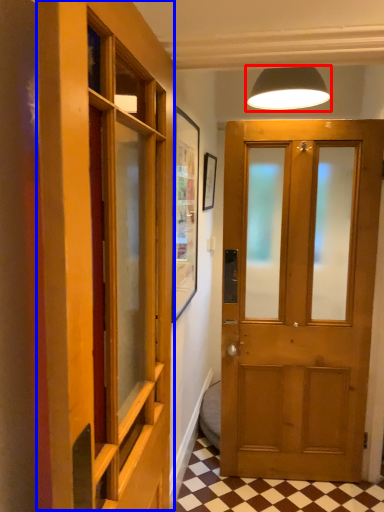
Question: Among these objects, which one is nearest to the camera, lamp (highlighted by a red box) or elevator (highlighted by a blue box)?

Choices:
 (A) lamp
 (B) elevator

Answer: (B)